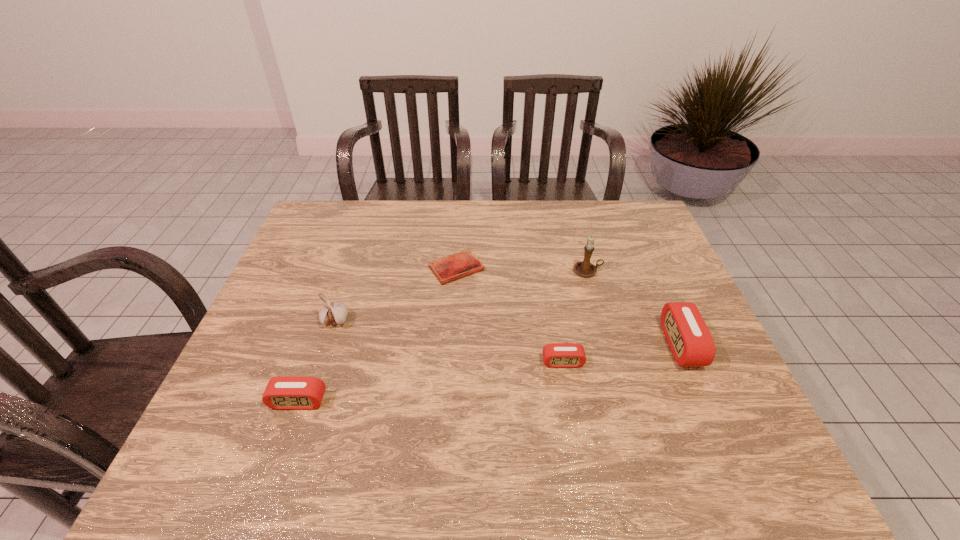
Find the location of a particular element. The image size is (960, 540). object situated at the right edge is located at coordinates (690, 341).

The height and width of the screenshot is (540, 960). I want to click on object located in the near left corner section of the desktop, so click(282, 393).

This screenshot has width=960, height=540. In order to click on free location at the far edge of the desktop in this screenshot , I will do `click(365, 228)`.

Identify the location of vacant space at the near edge of the desktop. (481, 415).

You are a GUI agent. You are given a task and a screenshot of the screen. Output one action in this format:
    pyautogui.click(x=<x>, y=<y>)
    Task: Click on the vacant space at the right edge of the desktop
    Image resolution: width=960 pixels, height=540 pixels.
    Given the screenshot: What is the action you would take?
    pyautogui.click(x=660, y=275)

In the image, there is a desktop. Where is `blank space at the far right corner`? blank space at the far right corner is located at coordinates (624, 205).

You are a GUI agent. You are given a task and a screenshot of the screen. Output one action in this format:
    pyautogui.click(x=<x>, y=<y>)
    Task: Click on the free region at the near right corner of the desktop
    The width and height of the screenshot is (960, 540).
    Given the screenshot: What is the action you would take?
    click(x=712, y=414)

This screenshot has width=960, height=540. In order to click on blank region between the garlic and the nearest alarm clock in this screenshot , I will do `click(317, 361)`.

At what (x,y) coordinates should I click in order to perform the action: click on vacant area that lies between the tallest alarm clock and the candle holder. Please return your answer as a coordinate pair (x, y). This screenshot has height=540, width=960. Looking at the image, I should click on (635, 308).

Identify the location of vacant region between the candle holder and the rightmost object. The image size is (960, 540). (635, 308).